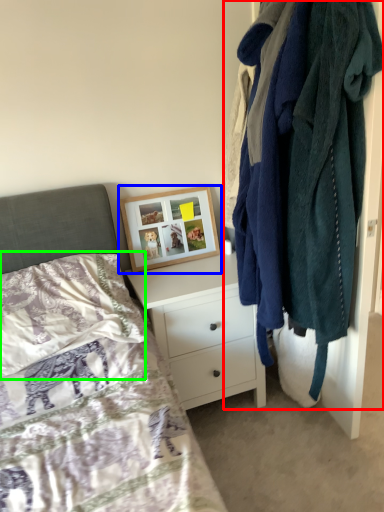
Question: Estimate the real-world distances between objects in this image. Which object is closer to closet (highlighted by a red box), picture frame (highlighted by a blue box) or pillow (highlighted by a green box)?

Choices:
 (A) picture frame
 (B) pillow

Answer: (A)